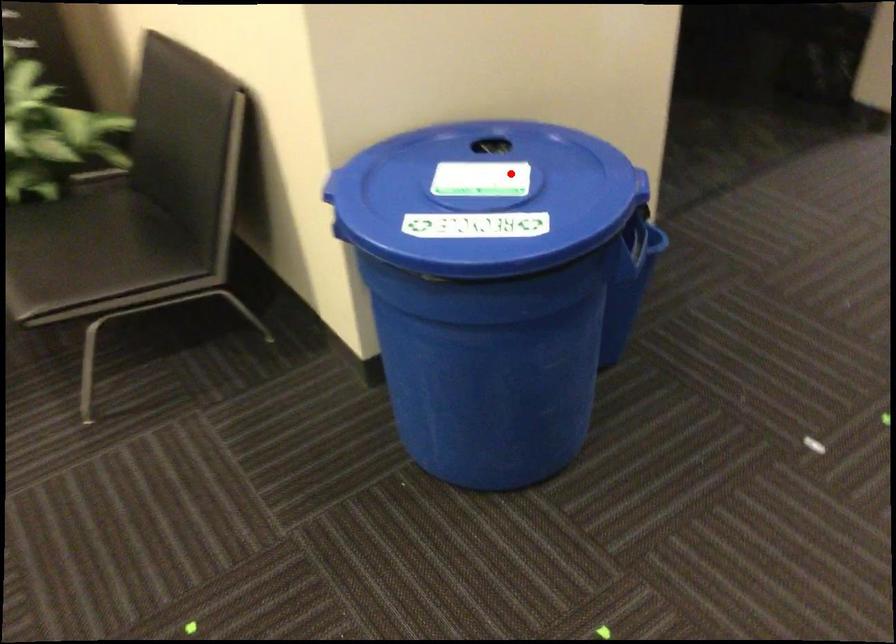
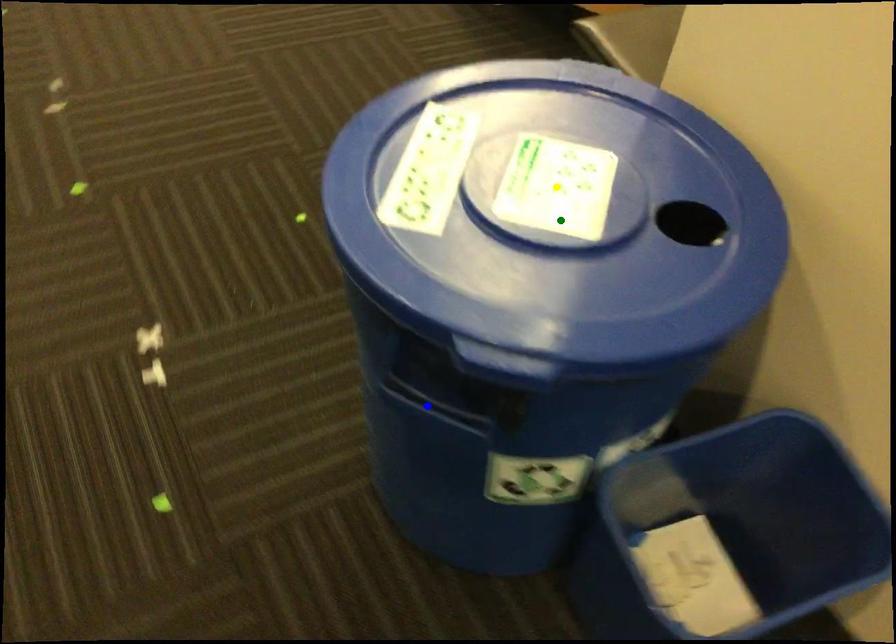
Question: I am providing you with two images of the same scene from different viewpoints. A red point is marked on the first image. You are given multiple points on the second image. In image 2, which mark is for the same physical point as the one in image 1?

Choices:
 (A) green point
 (B) yellow point
 (C) blue point

Answer: (A)